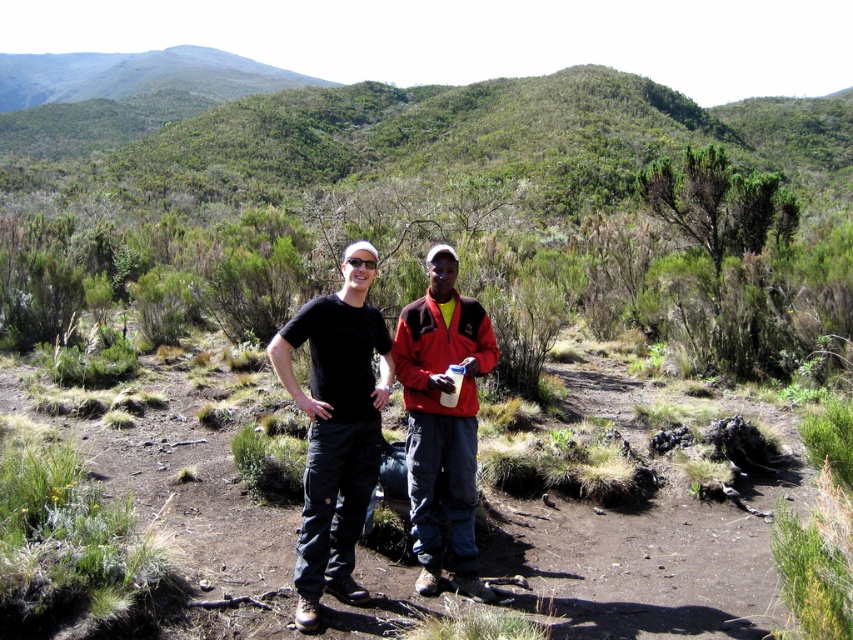
Is black fabric pants at center positioned behind red fleece jacket at center?

No, black fabric pants at center is closer to the viewer.

Does black fabric pants at center have a lesser height compared to red fleece jacket at center?

Result: Yes, black fabric pants at center is shorter than red fleece jacket at center.

Find the location of a particular element. This screenshot has width=853, height=640. black fabric pants at center is located at coordinates (335, 428).

Where is `black fabric pants at center`? This screenshot has width=853, height=640. black fabric pants at center is located at coordinates (335, 428).